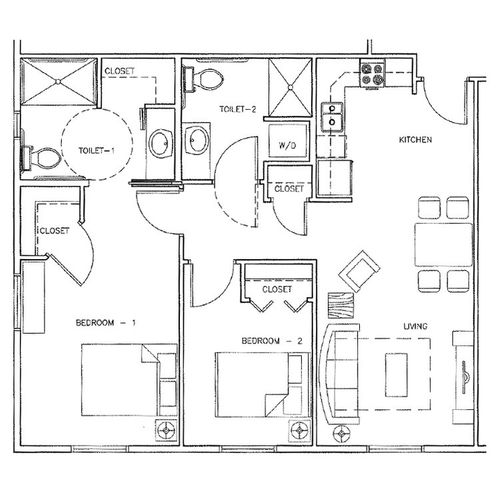
Locate an element on the screen. The width and height of the screenshot is (500, 500). bathrooms is located at coordinates (102, 135), (113, 99), (253, 58), (232, 117).